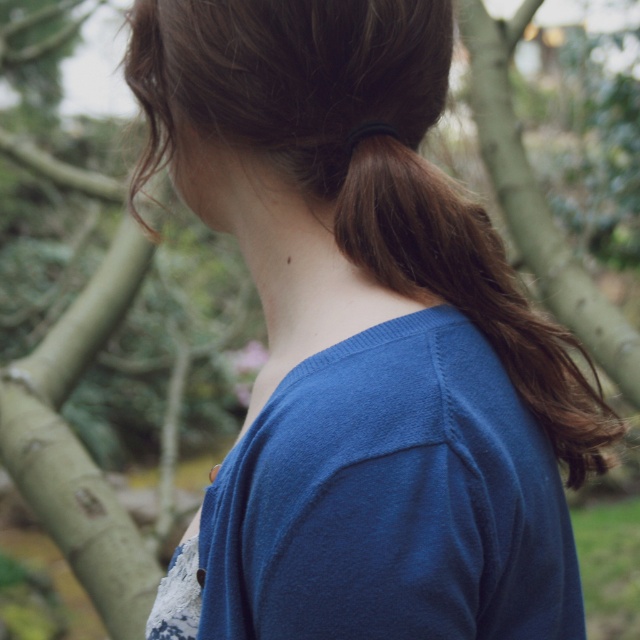
You are a photographer adjusting your camera to focus on two points in the image. The first point is at coordinates point (480, 493) and the second is at point (412, 202). Which point should you focus on first if you want to capture the subject closest to the viewer?

Point (480, 493) is closer to the viewer than point (412, 202), so you should focus on point (480, 493) first to capture the subject closest to the viewer.

You are taking a photo of the person wearing the blue cotton shirt at center. To ensure the shirt is in focus, where should you adjust the camera focus? Specify the coordinates from the Objects Description.

The blue cotton shirt at center is located at point (392, 500), so you should adjust the camera focus to that coordinate to ensure the shirt is in focus.

Looking at this image, you are a photographer adjusting your camera settings to capture the subject in this scene. You want to ensure both the blue cotton shirt at center and the brown silky hair at upper right are in focus. Given the current shallow depth of field, which object should you move closer to the camera to achieve this?

To ensure both the blue cotton shirt at center and the brown silky hair at upper right are in focus with the current shallow depth of field, you should move the brown silky hair at upper right closer to the camera since it is currently positioned above the blue cotton shirt at center and further away from the camera.